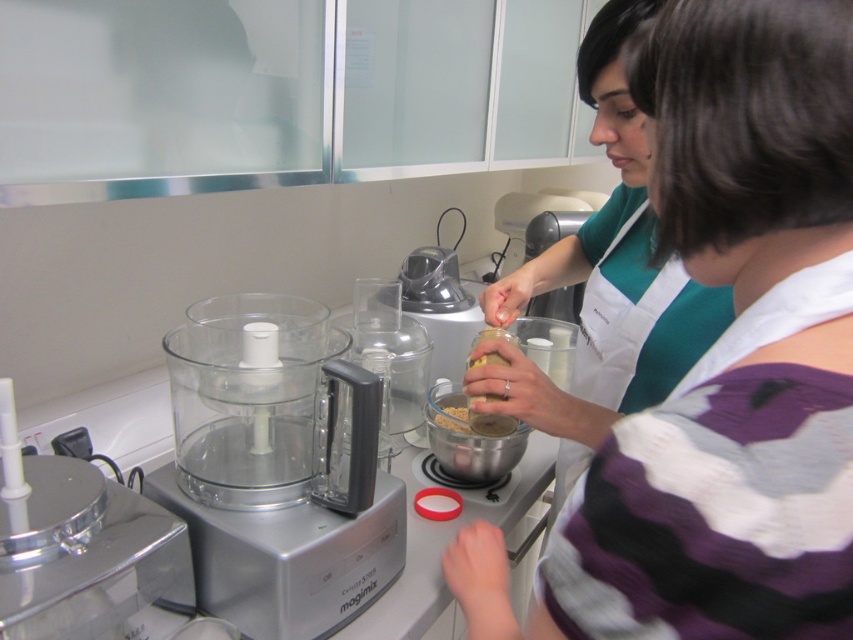
Question: Does white apron at center have a lesser width compared to brushed metal food processor at left?

Choices:
 (A) no
 (B) yes

Answer: (B)

Question: Is brushed metal food processor at left bigger than sandy brown plastic jar at center?

Choices:
 (A) yes
 (B) no

Answer: (A)

Question: Considering the real-world distances, which object is closest to the transparent plastic blender at center?

Choices:
 (A) silver/metallic food processor at left
 (B) brown matte jar at center
 (C) white apron at center

Answer: (B)

Question: Can you confirm if white apron at center is bigger than transparent plastic blender at center?

Choices:
 (A) no
 (B) yes

Answer: (B)

Question: Which of the following is the farthest from the observer?

Choices:
 (A) transparent plastic blender at center
 (B) brushed metal food processor at left

Answer: (A)

Question: Estimate the real-world distances between objects in this image. Which object is farther from the sandy brown plastic jar at center?

Choices:
 (A) white apron at center
 (B) silver/metallic food processor at left
 (C) brown matte jar at center

Answer: (A)